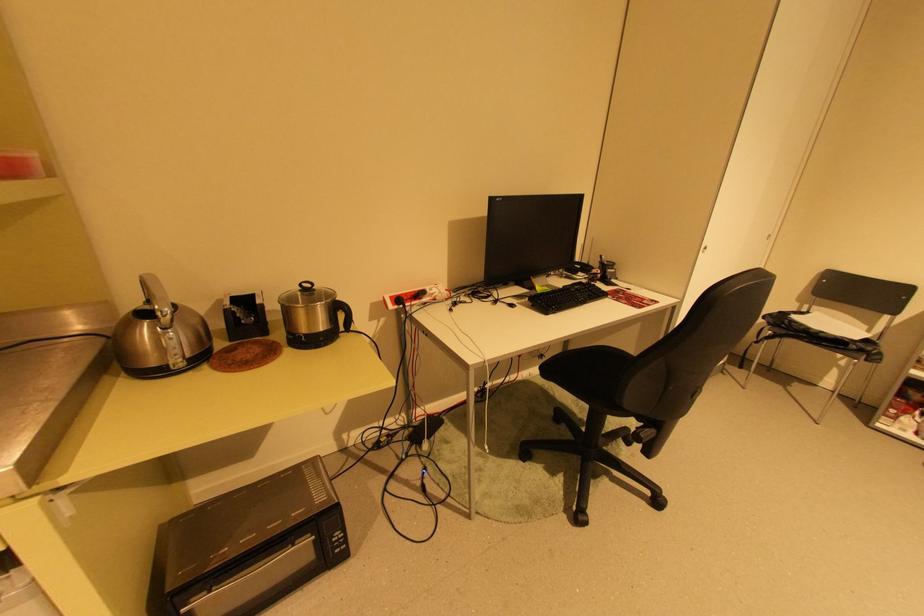
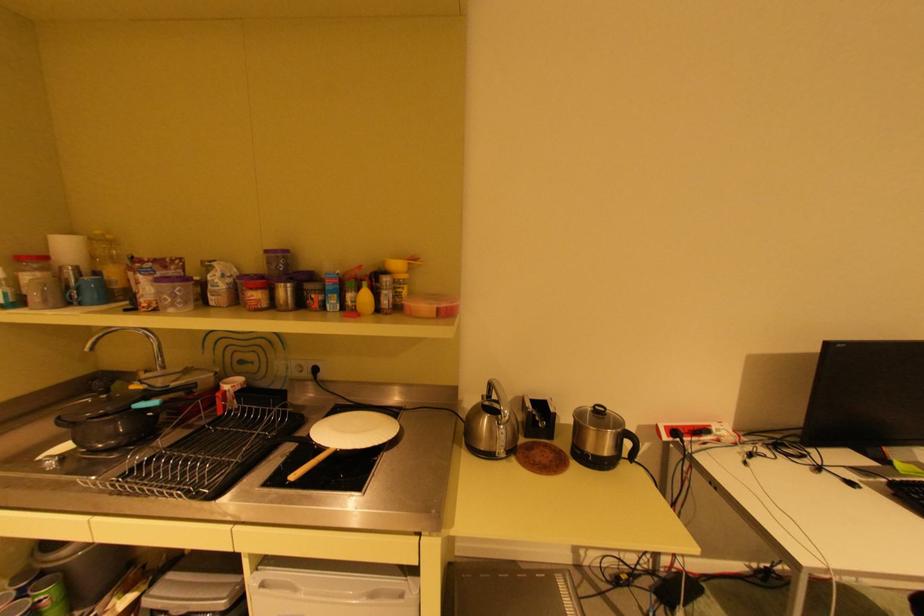
In the second image, find the point that corresponds to point (398, 297) in the first image.

(673, 427)